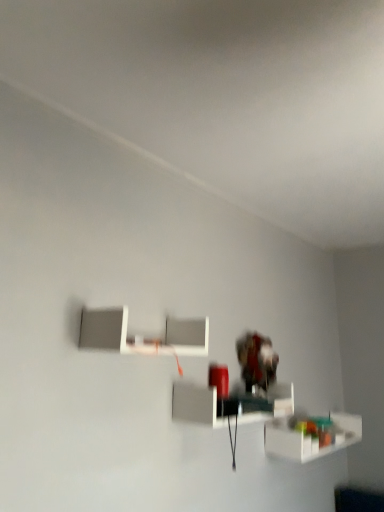
Question: Is translucent plastic shelf at lower right, placed as the first shelf when sorted from bottom to top, bigger than white matte shelf at upper center, which is the 3th shelf in right-to-left order?

Choices:
 (A) yes
 (B) no

Answer: (A)

Question: Is translucent plastic shelf at lower right, positioned as the third shelf in top-to-bottom order, not inside white matte shelf at upper center, the third shelf when ordered from bottom to top?

Choices:
 (A) yes
 (B) no

Answer: (A)

Question: Is translucent plastic shelf at lower right, placed as the first shelf when sorted from bottom to top, at the left side of white matte shelf at upper center, which is the 3th shelf in right-to-left order?

Choices:
 (A) no
 (B) yes

Answer: (A)

Question: Is translucent plastic shelf at lower right, placed as the first shelf when sorted from bottom to top, at the right side of white matte shelf at upper center, the third shelf when ordered from bottom to top?

Choices:
 (A) yes
 (B) no

Answer: (A)

Question: Is white matte shelf at upper center, the 1th shelf positioned from the left, at the back of translucent plastic shelf at lower right, arranged as the 3th shelf when viewed from the left?

Choices:
 (A) no
 (B) yes

Answer: (A)

Question: From the image's perspective, relative to translucent plastic shelf at lower right, positioned as the third shelf in top-to-bottom order, is white matte shelf at upper center, the 1th shelf viewed from the top, above or below?

Choices:
 (A) below
 (B) above

Answer: (B)

Question: Based on their sizes in the image, would you say white matte shelf at upper center, which is the 3th shelf in right-to-left order, is bigger or smaller than translucent plastic shelf at lower right, which is the 1th shelf in right-to-left order?

Choices:
 (A) small
 (B) big

Answer: (A)

Question: Relative to translucent plastic shelf at lower right, placed as the first shelf when sorted from bottom to top, is white matte shelf at upper center, the 1th shelf viewed from the top, in front or behind?

Choices:
 (A) front
 (B) behind

Answer: (A)

Question: Is white matte shelf at upper center, the 1th shelf viewed from the top, to the left or to the right of translucent plastic shelf at lower right, arranged as the 3th shelf when viewed from the left, in the image?

Choices:
 (A) left
 (B) right

Answer: (A)

Question: From the image's perspective, is white glossy shelf at center, which appears as the second shelf when viewed from the top, positioned above or below white matte shelf at upper center, the third shelf when ordered from bottom to top?

Choices:
 (A) below
 (B) above

Answer: (A)

Question: In terms of size, does white glossy shelf at center, which is counted as the second shelf, starting from the bottom, appear bigger or smaller than white matte shelf at upper center, the 1th shelf positioned from the left?

Choices:
 (A) big
 (B) small

Answer: (A)

Question: Considering their positions, is white glossy shelf at center, which appears as the second shelf when viewed from the top, located in front of or behind white matte shelf at upper center, the 1th shelf positioned from the left?

Choices:
 (A) behind
 (B) front

Answer: (A)

Question: Is point (203, 403) positioned closer to the camera than point (208, 323)?

Choices:
 (A) farther
 (B) closer

Answer: (B)

Question: Is translucent plastic shelf at lower right, arranged as the 3th shelf when viewed from the left, bigger or smaller than white glossy shelf at center, the 2th shelf positioned from the left?

Choices:
 (A) big
 (B) small

Answer: (A)

Question: Considering their positions, is translucent plastic shelf at lower right, positioned as the third shelf in top-to-bottom order, located in front of or behind white glossy shelf at center, which is counted as the second shelf, starting from the bottom?

Choices:
 (A) front
 (B) behind

Answer: (B)